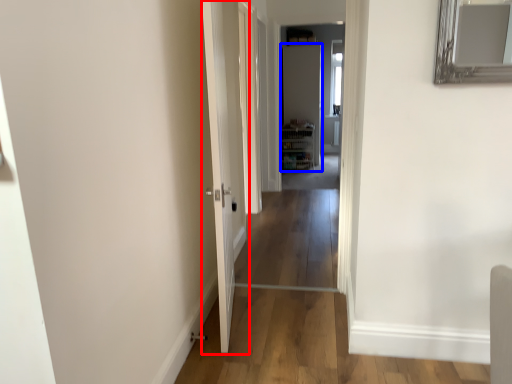
Question: Which object appears farthest to the camera in this image, door (highlighted by a red box) or door (highlighted by a blue box)?

Choices:
 (A) door
 (B) door

Answer: (B)